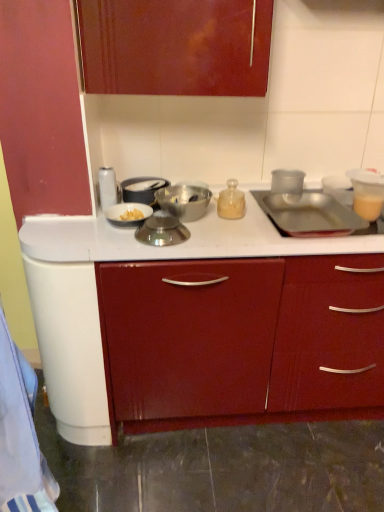
Question: From a real-world perspective, is shiny metallic bowl at center, which ranks as the 4th kitchen appliance in right-to-left order, positioned over metallic silver bowl at center, which ranks as the 5th kitchen appliance in right-to-left order, based on gravity?

Choices:
 (A) no
 (B) yes

Answer: (A)

Question: From a real-world perspective, is shiny metallic bowl at center, which ranks as the 4th kitchen appliance in right-to-left order, located beneath metallic silver bowl at center, acting as the third kitchen appliance starting from the left?

Choices:
 (A) no
 (B) yes

Answer: (B)

Question: Is shiny metallic bowl at center, which is the 4th kitchen appliance from left to right, positioned with its back to metallic silver bowl at center, acting as the third kitchen appliance starting from the left?

Choices:
 (A) no
 (B) yes

Answer: (B)

Question: Does shiny metallic bowl at center, which is the 4th kitchen appliance from left to right, have a lesser height compared to metallic silver bowl at center, which ranks as the 5th kitchen appliance in right-to-left order?

Choices:
 (A) no
 (B) yes

Answer: (B)

Question: Can you confirm if shiny metallic bowl at center, which is the 4th kitchen appliance from left to right, is smaller than metallic silver bowl at center, acting as the third kitchen appliance starting from the left?

Choices:
 (A) no
 (B) yes

Answer: (B)

Question: From the image's perspective, is transparent plastic cup at upper right, which ranks as the 1th kitchen appliance in right-to-left order, above or below metallic bowl at center, the 3th kitchen appliance viewed from the right?

Choices:
 (A) below
 (B) above

Answer: (B)

Question: Is transparent plastic cup at upper right, the seventh kitchen appliance in the left-to-right sequence, taller or shorter than metallic bowl at center, which is the fifth kitchen appliance in left-to-right order?

Choices:
 (A) tall
 (B) short

Answer: (A)

Question: From a real-world perspective, is transparent plastic cup at upper right, which ranks as the 1th kitchen appliance in right-to-left order, above or below metallic bowl at center, the 3th kitchen appliance viewed from the right?

Choices:
 (A) above
 (B) below

Answer: (B)

Question: Looking at their shapes, would you say transparent plastic cup at upper right, the seventh kitchen appliance in the left-to-right sequence, is wider or thinner than metallic bowl at center, which is the fifth kitchen appliance in left-to-right order?

Choices:
 (A) thin
 (B) wide

Answer: (A)

Question: From a real-world perspective, is translucent plastic cup at upper right physically located above or below metallic bowl at center, which is the fifth kitchen appliance in left-to-right order?

Choices:
 (A) above
 (B) below

Answer: (A)

Question: Is point (357, 179) positioned closer to the camera than point (175, 196)?

Choices:
 (A) farther
 (B) closer

Answer: (A)

Question: From the image's perspective, is translucent plastic cup at upper right positioned above or below metallic bowl at center, which is the fifth kitchen appliance in left-to-right order?

Choices:
 (A) above
 (B) below

Answer: (A)

Question: Relative to metallic bowl at center, which is the fifth kitchen appliance in left-to-right order, is translucent plastic cup at upper right in front or behind?

Choices:
 (A) behind
 (B) front

Answer: (A)

Question: From a real-world perspective, is white glossy canister at upper left, which is the 7th kitchen appliance in right-to-left order, positioned above or below metallic bowl at center, the 3th kitchen appliance viewed from the right?

Choices:
 (A) above
 (B) below

Answer: (A)

Question: Is point (99, 168) closer or farther from the camera than point (201, 207)?

Choices:
 (A) farther
 (B) closer

Answer: (A)